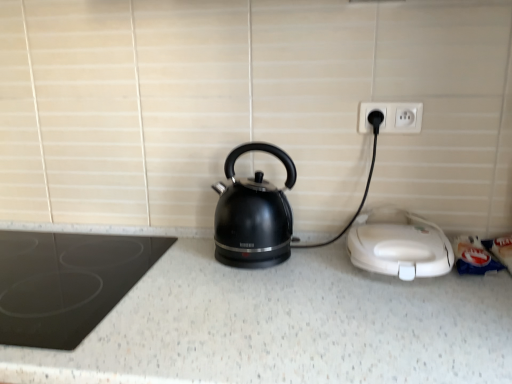
I want to click on vacant space that is to the left of black glossy kettle at center, so pos(175,261).